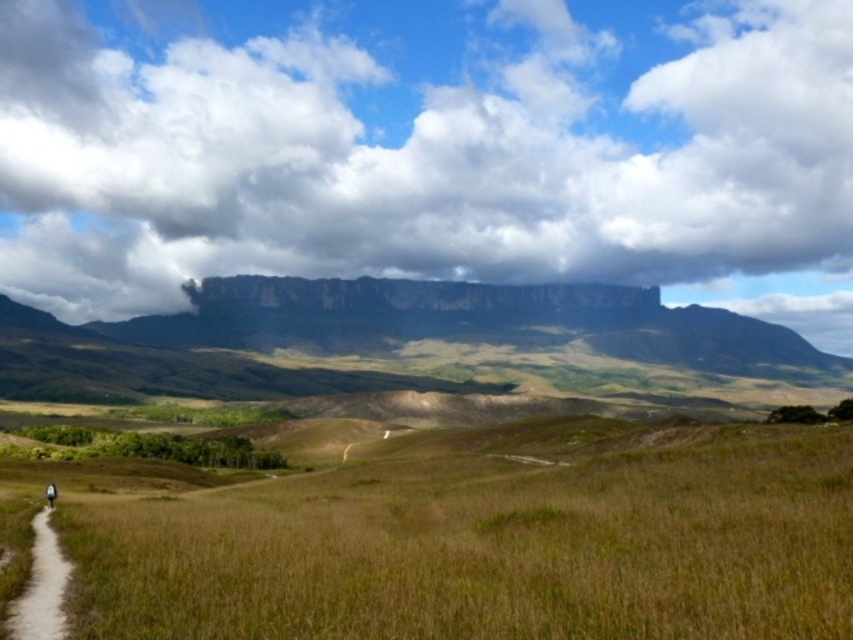
You are a photographer planning to capture the cloudy sky at upper center and the brown dirt path at lower left in a single frame. Which object will occupy a larger portion of the image horizontally?

The cloudy sky at upper center will occupy a larger portion of the image horizontally because its width surpasses that of the brown dirt path at lower left.

You are a hiker standing at the starting point of the dirt path. You see the brown dry grass at lower center and the brown dirt path at lower left. Which object is closer to you?

The brown dry grass at lower center is closer to you since it is in front of the brown dirt path at lower left.